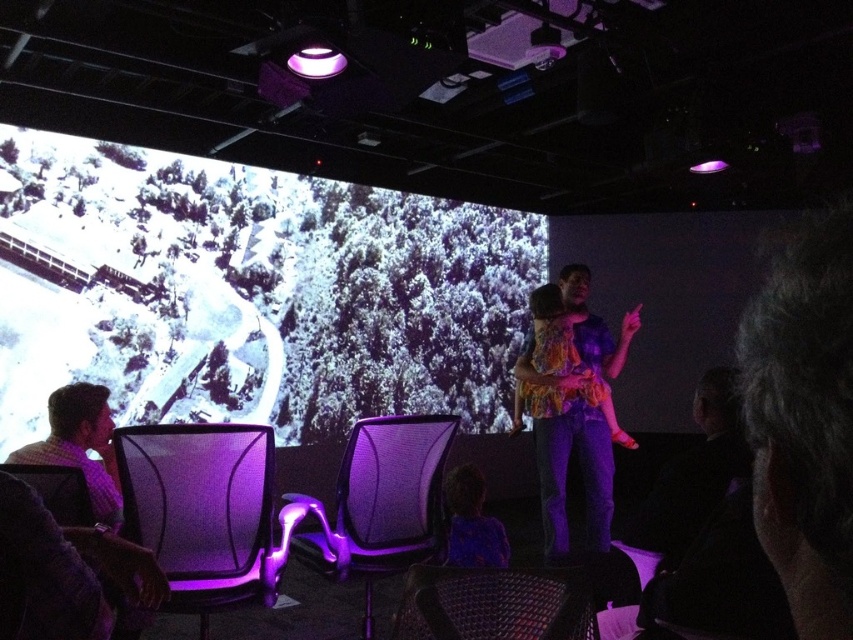
In the scene shown: Between mesh fabric chair at lower left and purple mesh chair at center, which one appears on the left side from the viewer's perspective?

mesh fabric chair at lower left

Is mesh fabric chair at lower left thinner than purple mesh chair at center?

Indeed, mesh fabric chair at lower left has a lesser width compared to purple mesh chair at center.

Between point (163, 468) and point (393, 524), which one is positioned in front?

Positioned in front is point (163, 468).

I want to click on mesh fabric chair at lower left, so click(x=206, y=509).

Where is `multicolored fabric shirt at center`? The height and width of the screenshot is (640, 853). multicolored fabric shirt at center is located at coordinates (572, 403).

Who is lower down, multicolored fabric shirt at center or purple mesh chair at center?

purple mesh chair at center is lower down.

At what (x,y) coordinates should I click in order to perform the action: click on multicolored fabric shirt at center. Please return your answer as a coordinate pair (x, y). Looking at the image, I should click on (572, 403).

Is white matte projection screen at upper left below purple mesh chair at center?

Incorrect, white matte projection screen at upper left is not positioned below purple mesh chair at center.

Is point (57, 228) more distant than point (399, 524)?

Yes, it is.

The image size is (853, 640). I want to click on white matte projection screen at upper left, so click(256, 292).